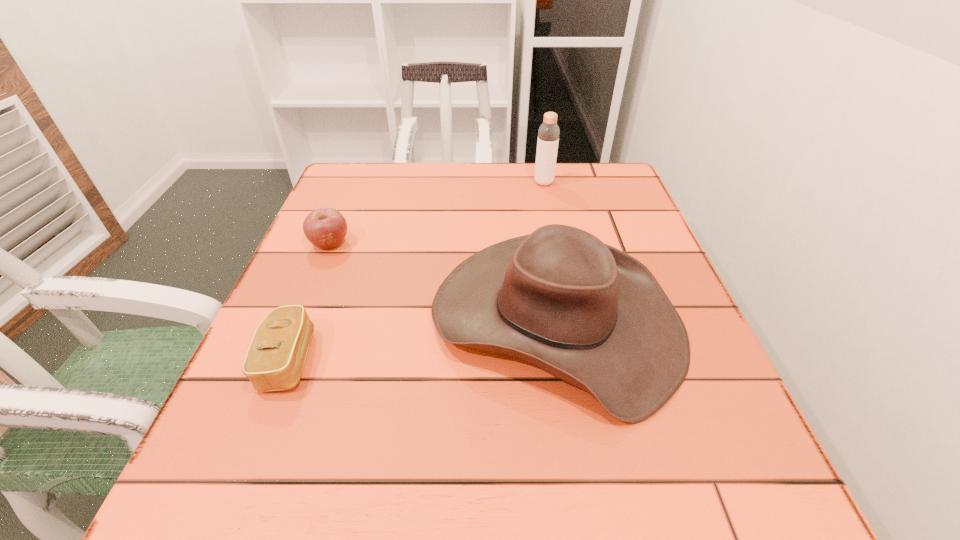
I want to click on apple present at the left edge, so click(x=325, y=228).

Find the location of a particular element. The width and height of the screenshot is (960, 540). clutch bag located at the left edge is located at coordinates (275, 359).

You are a GUI agent. You are given a task and a screenshot of the screen. Output one action in this format:
    pyautogui.click(x=<x>, y=<y>)
    Task: Click on the object present at the right edge
    The width and height of the screenshot is (960, 540).
    Given the screenshot: What is the action you would take?
    pyautogui.click(x=585, y=312)

Find the location of a particular element. vacant space at the far edge of the desktop is located at coordinates (459, 188).

At what (x,y) coordinates should I click in order to perform the action: click on vacant area at the near edge of the desktop. Please return your answer as a coordinate pair (x, y). The image size is (960, 540). Looking at the image, I should click on (503, 508).

In the image, there is a desktop. Where is `free space at the left edge`? The height and width of the screenshot is (540, 960). free space at the left edge is located at coordinates [x=291, y=297].

The image size is (960, 540). What are the coordinates of `vacant area at the far left corner` in the screenshot? It's located at (388, 210).

This screenshot has width=960, height=540. In the image, there is a desktop. Identify the location of blank space at the far right corner. (562, 168).

This screenshot has width=960, height=540. Identify the location of vacant space at the near right corner of the desktop. (708, 508).

You are a GUI agent. You are given a task and a screenshot of the screen. Output one action in this format:
    pyautogui.click(x=<x>, y=<y>)
    Task: Click on the vacant area that lies between the apple and the tallest object
    This screenshot has width=960, height=540.
    Given the screenshot: What is the action you would take?
    pyautogui.click(x=437, y=213)